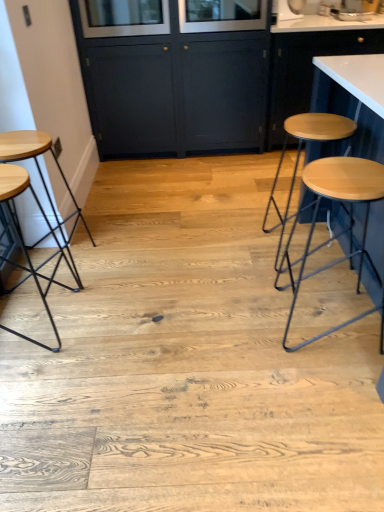
Locate an element on the screen. vacant space situated above wooden seat at left, placed as the second stool when sorted from right to left (from a real-world perspective) is located at coordinates (24, 139).